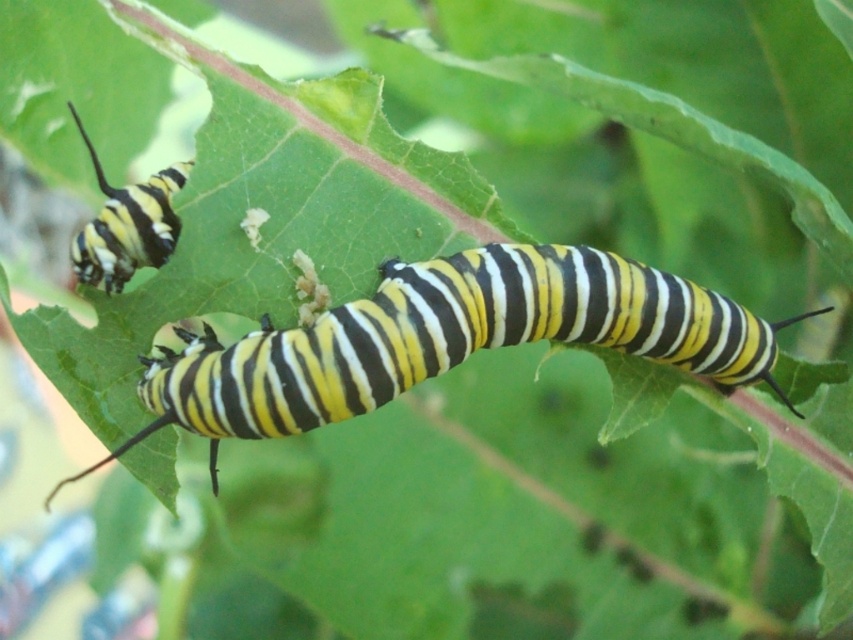
Which of these two, yellow-black-striped caterpillar at center or yellow striped caterpillar at upper left, stands shorter?

With less height is yellow striped caterpillar at upper left.

Who is lower down, yellow-black-striped caterpillar at center or yellow striped caterpillar at upper left?

yellow-black-striped caterpillar at center is lower down.

In order to click on yellow-black-striped caterpillar at center in this screenshot , I will do `click(444, 340)`.